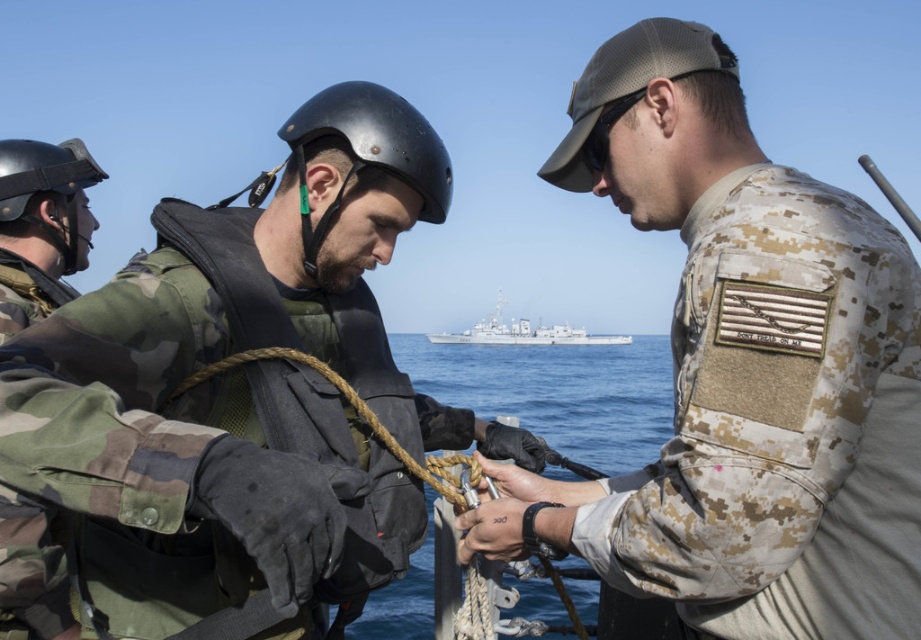
You are a military observer assessing the positioning of personnel during a training exercise. You see the camouflage fabric jacket at center and the black matte helmet at left. Which personnel is positioned more to the left?

The black matte helmet at left is positioned more to the left than the camouflage fabric jacket at center.

You are a sailor on a ship and need to secure a large object using the rope at center and the white matte ship at center. Which object should you use if you need something bigger in size?

The rope at center is larger in size than the white matte ship at center, so you should use the rope at center to secure the large object.

What are the coordinates of the camouflage fabric jacket at center?

The camouflage fabric jacket at center is located at coordinates point (236, 396).